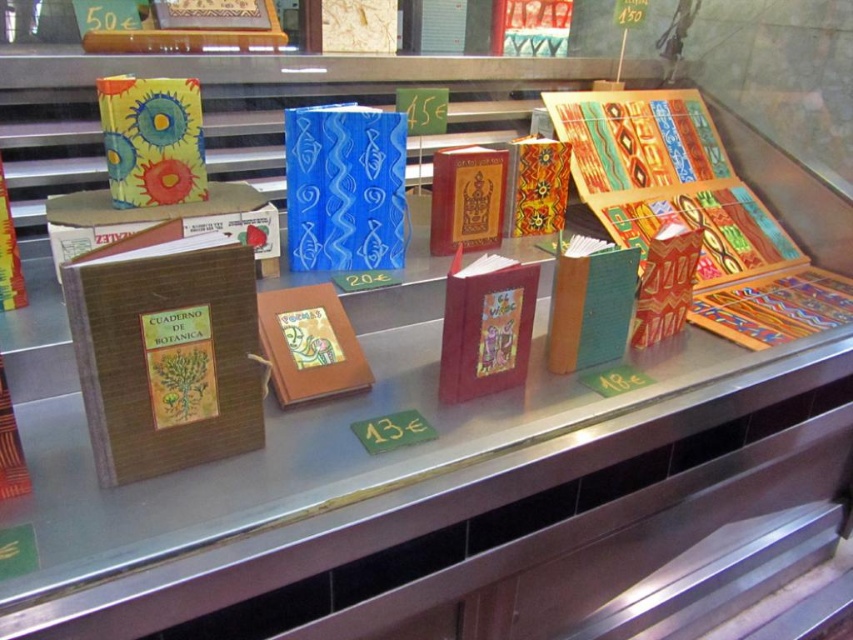
You are a customer looking at the notebooks displayed in the shop window. You see the blue paper notebook at center and the watercolor paper notebook at upper left. Which notebook is placed higher up on the display?

The watercolor paper notebook at upper left is placed higher up because the blue paper notebook at center is positioned under it.

You are a customer looking at the display of notebooks in the shop window. You see the blue paper notebook at center. Can you determine its exact location based on the coordinates provided?

The blue paper notebook at center is located at point (344, 188).

You are a customer in a stationery store and see the blue paper notebook at center and the watercolor paper notebook at upper left on display. Which notebook is taller?

The blue paper notebook at center is taller than the watercolor paper notebook at upper left.